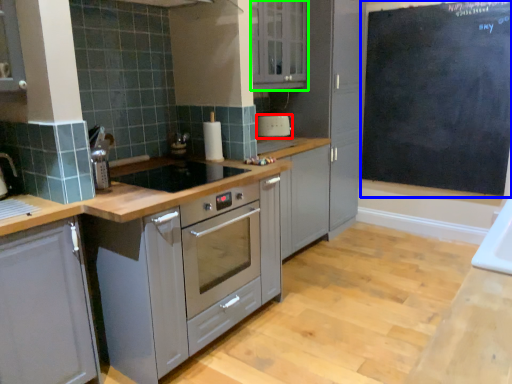
Question: Which object is the closest to the home appliance (highlighted by a red box)? Choose among these: bulletin board (highlighted by a blue box) or cabinetry (highlighted by a green box).

Choices:
 (A) bulletin board
 (B) cabinetry

Answer: (B)